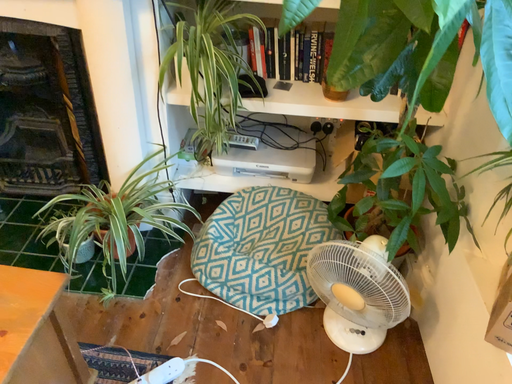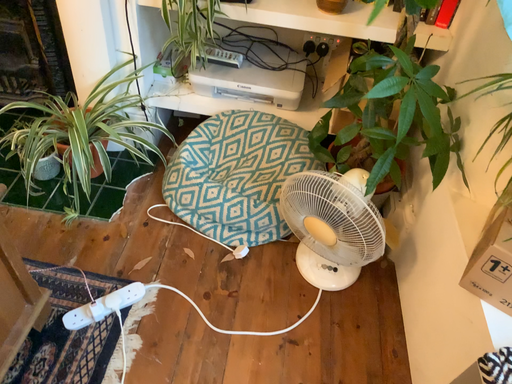
Question: Which way did the camera rotate in the video?

Choices:
 (A) rotated upward
 (B) rotated downward

Answer: (B)